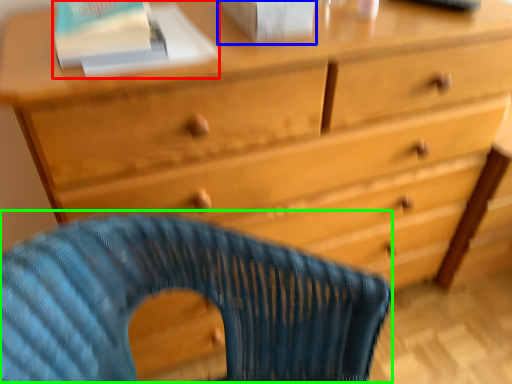
Question: Which object is positioned closest to paperback book (highlighted by a red box)? Select from paperback book (highlighted by a blue box) and rocking chair (highlighted by a green box).

Choices:
 (A) paperback book
 (B) rocking chair

Answer: (A)